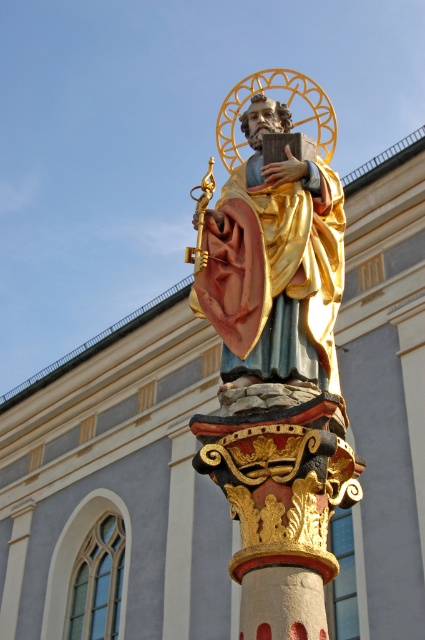
Is point (229, 150) closer to camera compared to point (261, 342)?

No, (229, 150) is further to viewer.

Who is taller, gold plated statue at center or gold leaf statue at center?

Standing taller between the two is gold plated statue at center.

Does point (306, 164) come closer to viewer compared to point (278, 125)?

Yes, point (306, 164) is in front of point (278, 125).

This screenshot has height=640, width=425. Identify the location of gold plated statue at center. (275, 250).